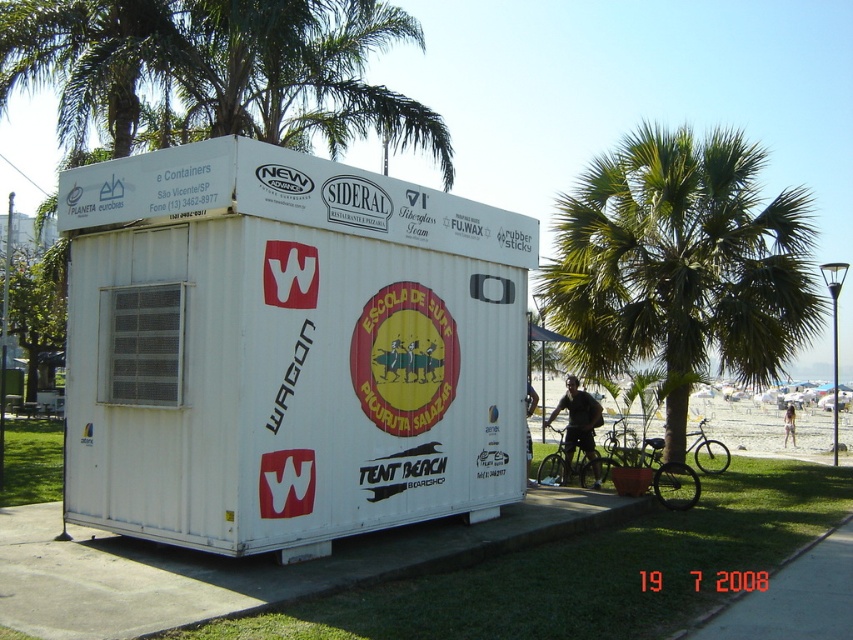
Is white matte shipping container at center above green leafy palm tree at center?

No, white matte shipping container at center is not above green leafy palm tree at center.

The width and height of the screenshot is (853, 640). I want to click on white matte shipping container at center, so click(x=286, y=348).

Does point (206, 172) come farther from viewer compared to point (550, 301)?

No, (206, 172) is in front of (550, 301).

The height and width of the screenshot is (640, 853). In order to click on white matte shipping container at center in this screenshot , I will do `click(286, 348)`.

Is metallic silver bicycle at lower center further to camera compared to dark brown leather jacket at center?

That is False.

Who is shorter, metallic silver bicycle at lower center or dark brown leather jacket at center?

With less height is dark brown leather jacket at center.

Does point (683, 476) lie in front of point (584, 433)?

No, it is behind (584, 433).

At what (x,y) coordinates should I click in order to perform the action: click on metallic silver bicycle at lower center. Please return your answer as a coordinate pair (x, y). Image resolution: width=853 pixels, height=640 pixels. Looking at the image, I should click on (659, 472).

Does white matte shipping container at center have a greater width compared to metallic silver bicycle at lower center?

Yes.

Does white matte shipping container at center have a greater height compared to metallic silver bicycle at lower center?

Indeed, white matte shipping container at center has a greater height compared to metallic silver bicycle at lower center.

In the scene shown: Measure the distance between point (463, 486) and camera.

The distance of point (463, 486) from camera is 26.92 feet.

Image resolution: width=853 pixels, height=640 pixels. I want to click on white matte shipping container at center, so click(286, 348).